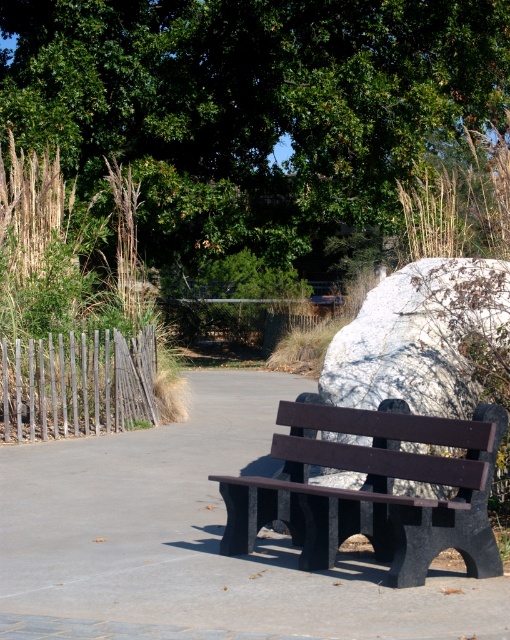
You are a park visitor who wants to sit on the benches. Which bench, the dark gray concrete bench at center or the matte black bench at center, is positioned higher up?

The matte black bench at center is positioned higher up because the dark gray concrete bench at center is below it.

You are planning to take a nap on the dark gray concrete bench at center. Considering the presence of the green leafy tree at upper center, will you be able to enjoy shade from it while lying on the bench?

The green leafy tree at upper center is larger than the dark gray concrete bench at center, so it is likely that the tree provides sufficient shade over the bench, allowing you to enjoy shade while lying there.